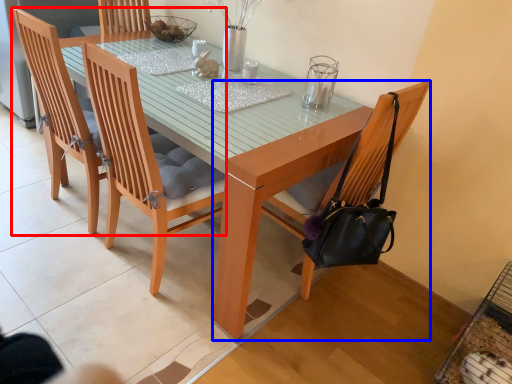
Question: Which point is closer to the camera, chair (highlighted by a red box) or chair (highlighted by a blue box)?

Choices:
 (A) chair
 (B) chair

Answer: (B)